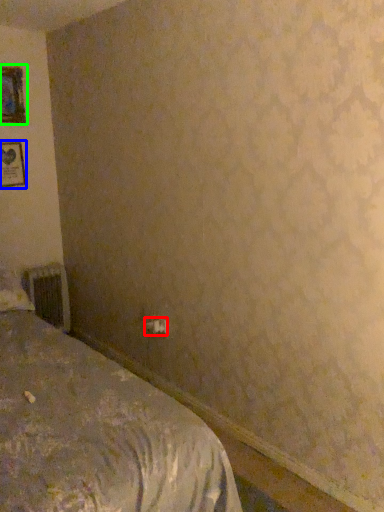
Question: Which object is the closest to the electric outlet (highlighted by a red box)? Choose among these: picture frame (highlighted by a blue box) or picture frame (highlighted by a green box).

Choices:
 (A) picture frame
 (B) picture frame

Answer: (A)